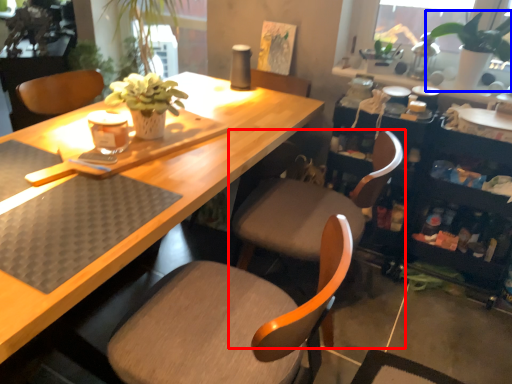
Question: Which of the following is the closest to the observer, chair (highlighted by a red box) or houseplant (highlighted by a blue box)?

Choices:
 (A) chair
 (B) houseplant

Answer: (A)